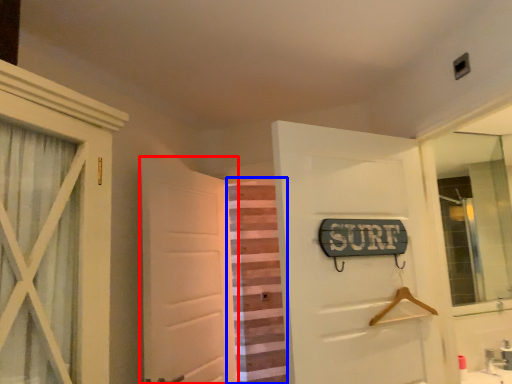
Question: Which object appears farthest to the camera in this image, door (highlighted by a red box) or curtain (highlighted by a blue box)?

Choices:
 (A) door
 (B) curtain

Answer: (B)